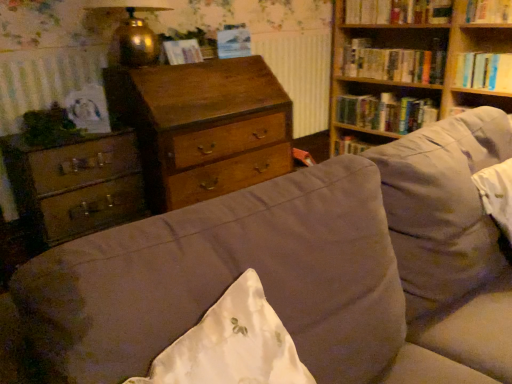
Question: Should I look upward or downward to see suede-like beige couch at center?

Choices:
 (A) up
 (B) down

Answer: (B)

Question: Is hardcover book at upper right, the fourth book viewed from the top, not within wooden bookshelf at upper right?

Choices:
 (A) yes
 (B) no

Answer: (B)

Question: Is hardcover book at upper right, the first book when ordered from bottom to top, facing away from wooden bookshelf at upper right?

Choices:
 (A) yes
 (B) no

Answer: (A)

Question: From a real-world perspective, is hardcover book at upper right, the first book when ordered from bottom to top, positioned under wooden bookshelf at upper right based on gravity?

Choices:
 (A) yes
 (B) no

Answer: (A)

Question: Is hardcover book at upper right, the fourth book viewed from the top, at the left side of wooden bookshelf at upper right?

Choices:
 (A) yes
 (B) no

Answer: (A)

Question: Could you tell me if hardcover book at upper right, the fourth book viewed from the top, is facing wooden bookshelf at upper right?

Choices:
 (A) yes
 (B) no

Answer: (A)

Question: Is hardcover book at upper right, the first book when ordered from bottom to top, positioned behind wooden bookshelf at upper right?

Choices:
 (A) no
 (B) yes

Answer: (B)

Question: Can we say gold metallic lamp at upper left lies outside wooden chest of drawers at center, marked as the 2th chest of drawers in a left-to-right arrangement?

Choices:
 (A) no
 (B) yes

Answer: (B)

Question: Is gold metallic lamp at upper left facing away from wooden chest of drawers at center, the 1th chest of drawers viewed from the right?

Choices:
 (A) no
 (B) yes

Answer: (A)

Question: Can you confirm if gold metallic lamp at upper left is smaller than wooden chest of drawers at center, the 1th chest of drawers viewed from the right?

Choices:
 (A) yes
 (B) no

Answer: (A)

Question: Can you confirm if gold metallic lamp at upper left is positioned to the left of wooden chest of drawers at center, marked as the 2th chest of drawers in a left-to-right arrangement?

Choices:
 (A) no
 (B) yes

Answer: (B)

Question: From the image's perspective, would you say gold metallic lamp at upper left is positioned over wooden chest of drawers at center, the 1th chest of drawers viewed from the right?

Choices:
 (A) no
 (B) yes

Answer: (B)

Question: Is gold metallic lamp at upper left positioned behind wooden chest of drawers at center, the 1th chest of drawers viewed from the right?

Choices:
 (A) yes
 (B) no

Answer: (B)

Question: Is hardcover book at upper right, which appears as the third book when viewed from the top, positioned beyond the bounds of suede-like beige couch at center?

Choices:
 (A) yes
 (B) no

Answer: (A)